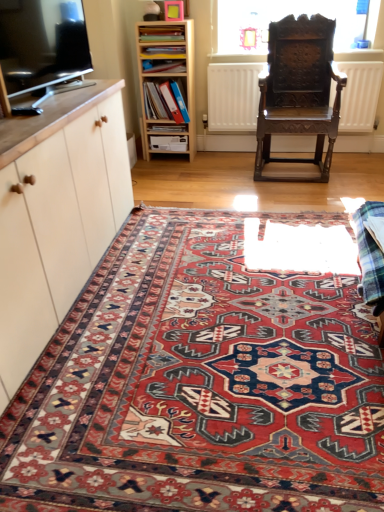
Question: Considering the positions of point (44, 179) and point (147, 129), is point (44, 179) closer or farther from the camera than point (147, 129)?

Choices:
 (A) farther
 (B) closer

Answer: (B)

Question: In terms of width, does matte white cabinet at left look wider or thinner when compared to matte cardboard book at center, the fourth book positioned from the top?

Choices:
 (A) thin
 (B) wide

Answer: (B)

Question: Which of these objects is positioned farthest from the dark brown wood chair at center?

Choices:
 (A) plaid fabric at lower right
 (B) matte plastic book at upper center, the 3th book in the bottom-to-top sequence
 (C) matte cardboard book at center, the fourth book positioned from the top
 (D) transparent glass window at upper center
 (E) matte wooden bookshelf at upper center, which appears as the first book when viewed from the top

Answer: (A)

Question: Which object is positioned farthest from the dark brown wood chair at center?

Choices:
 (A) white matte radiator at center
 (B) matte cardboard book at center, the fourth book positioned from the top
 (C) transparent glass window at upper center
 (D) matte wooden bookshelf at upper center, which appears as the first book when viewed from the top
 (E) light wood shelf at upper center

Answer: (D)